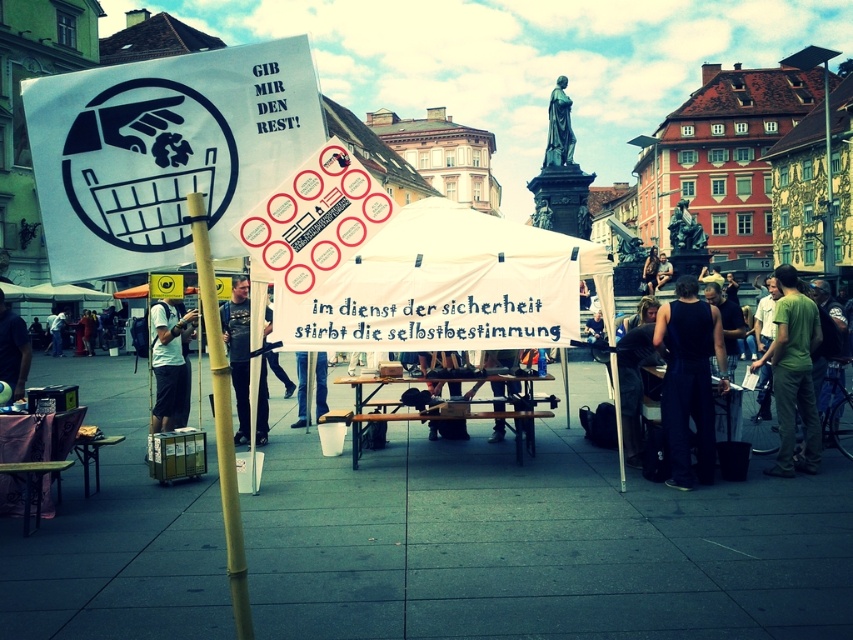
Question: Which object is closer to the camera taking this photo?

Choices:
 (A) white cotton shirt at center
 (B) white fabric canopy at center
 (C) dark blue jeans at center
 (D) green cotton shirt at right

Answer: (B)

Question: Can you confirm if yellow matte pole at center is positioned to the right of dark blue jeans at center?

Choices:
 (A) yes
 (B) no

Answer: (A)

Question: Which point appears farthest from the camera in this image?

Choices:
 (A) (3, 358)
 (B) (241, 106)
 (C) (381, 248)

Answer: (A)

Question: Can you confirm if white cotton shirt at center is wider than dark blue shirt at lower left?

Choices:
 (A) no
 (B) yes

Answer: (A)

Question: Does black fabric pants at center have a lesser width compared to dark blue shirt at lower left?

Choices:
 (A) no
 (B) yes

Answer: (B)

Question: Which object appears farthest from the camera in this image?

Choices:
 (A) dark blue shirt at lower left
 (B) dark blue jeans at center

Answer: (B)